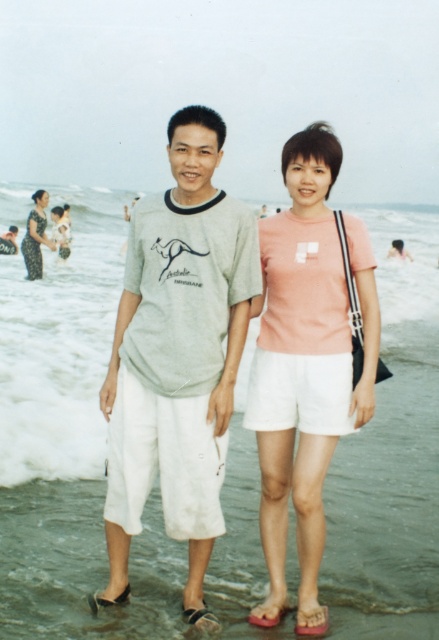
Question: Can you confirm if light gray cotton t-shirt at center is wider than pink matte t-shirt at center?

Choices:
 (A) yes
 (B) no

Answer: (A)

Question: Which point is closer to the camera?

Choices:
 (A) brown leather sandal at lower center
 (B) printed fabric dress at left

Answer: (A)

Question: Which is nearer to the brown leather sandal at lower center?

Choices:
 (A) pink matte t-shirt at center
 (B) printed fabric dress at left

Answer: (A)

Question: Which of the following is the farthest from the observer?

Choices:
 (A) (122, 589)
 (B) (43, 218)

Answer: (B)

Question: Can you confirm if pink matte t-shirt at center is bigger than brown leather sandal at lower center?

Choices:
 (A) no
 (B) yes

Answer: (B)

Question: Does printed fabric dress at left lie in front of brown leather sandal at lower center?

Choices:
 (A) yes
 (B) no

Answer: (B)